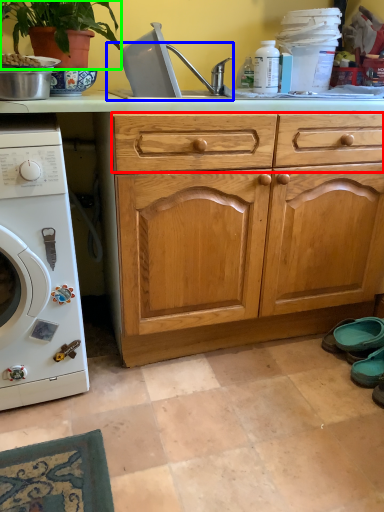
Question: Considering the real-world distances, which object is farthest from drawer (highlighted by a red box)? sink (highlighted by a blue box) or houseplant (highlighted by a green box)?

Choices:
 (A) sink
 (B) houseplant

Answer: (B)